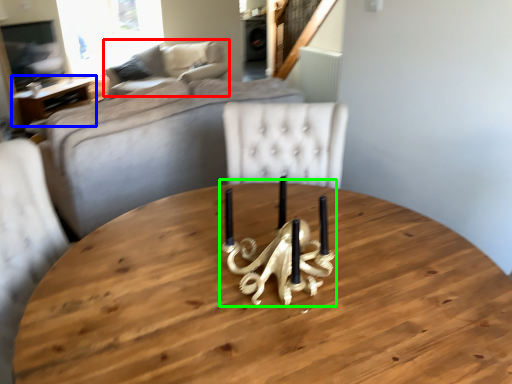
Question: Based on their relative distances, which object is farther from couch (highlighted by a red box)? Choose from table (highlighted by a blue box) and candle holder (highlighted by a green box).

Choices:
 (A) table
 (B) candle holder

Answer: (B)